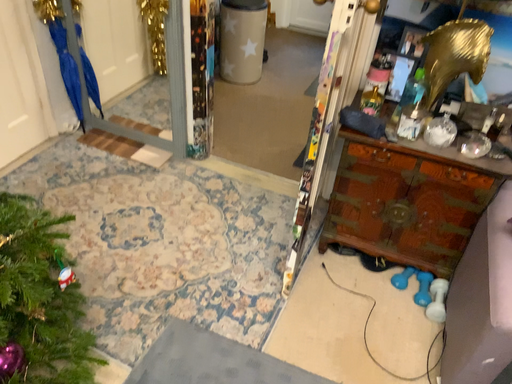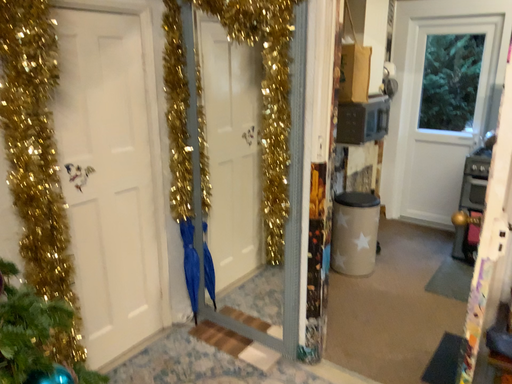
Question: How did the camera likely rotate when shooting the video?

Choices:
 (A) rotated downward
 (B) rotated upward

Answer: (B)